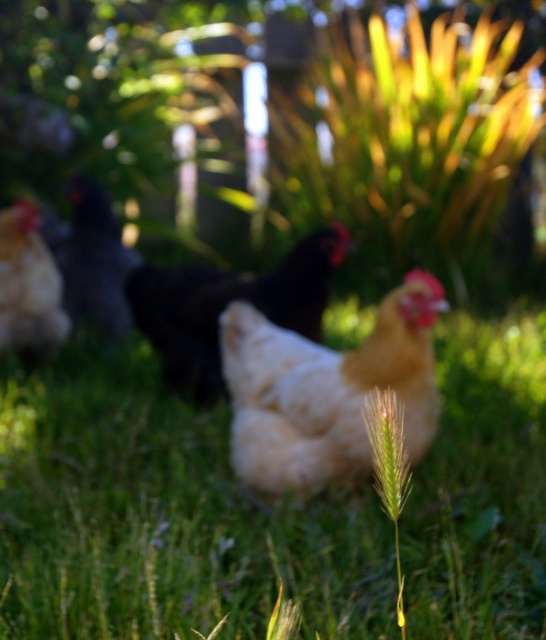
Question: Is white matte chicken at center bigger than black matte chicken at left?

Choices:
 (A) yes
 (B) no

Answer: (A)

Question: Which point is closer to the camera taking this photo?

Choices:
 (A) (111, 593)
 (B) (316, 422)
 (C) (2, 211)
 (D) (175, 317)

Answer: (A)

Question: From the image, what is the correct spatial relationship of white fluffy chicken at center in relation to matte yellow chicken at left?

Choices:
 (A) left
 (B) right

Answer: (B)

Question: Which is farther from the black matte chicken at left?

Choices:
 (A) green soft grass at center
 (B) white fluffy chicken at center

Answer: (B)

Question: Observing the image, what is the correct spatial positioning of green soft grass at center in reference to white matte chicken at center?

Choices:
 (A) left
 (B) right

Answer: (B)

Question: Based on their relative distances, which object is farther from the green soft grass at center?

Choices:
 (A) black matte chicken at left
 (B) matte yellow chicken at left
 (C) white matte chicken at center
 (D) white fluffy chicken at center

Answer: (A)